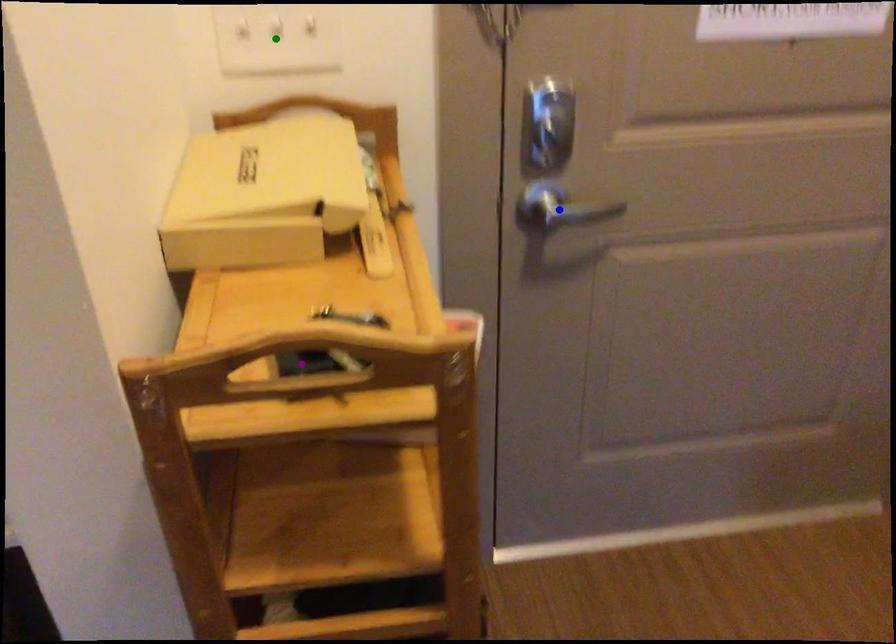
Order these from farthest to nearest:
A) blue point
B) purple point
C) green point

A: blue point < green point < purple point